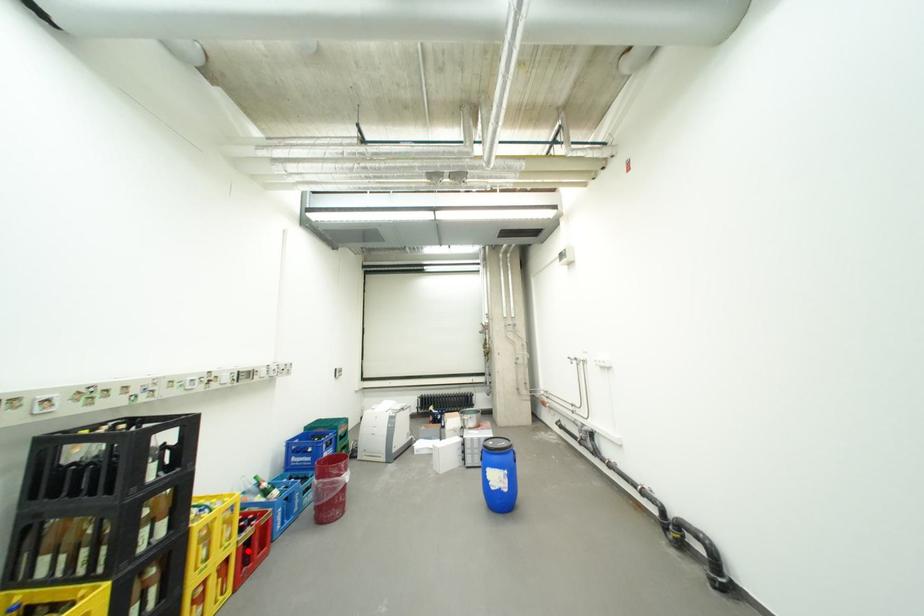
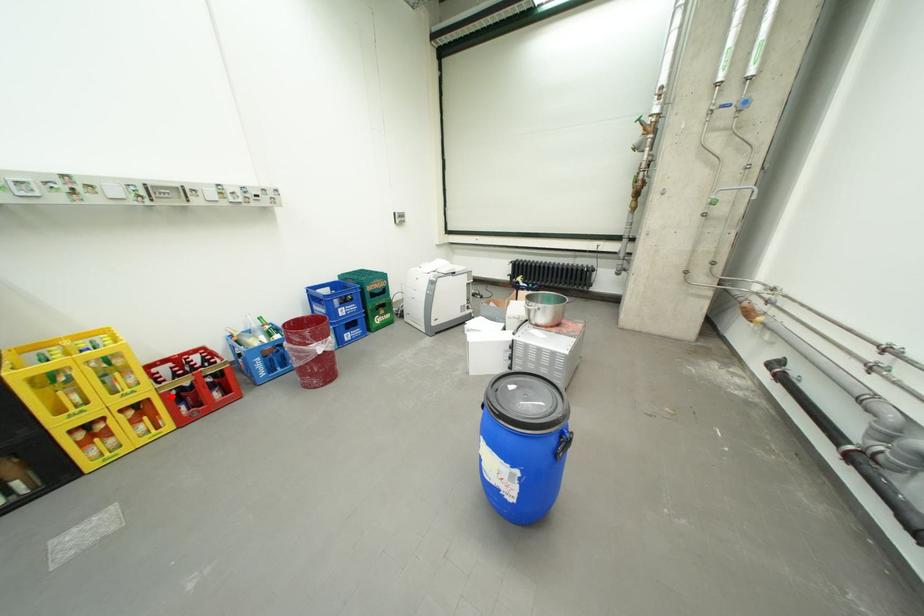
I am providing you with two images of the same scene from different viewpoints. A red point is marked on the first image and another point is marked on the second image. Does the point marked in image1 correspond to the same location as the one in image2?

Yes